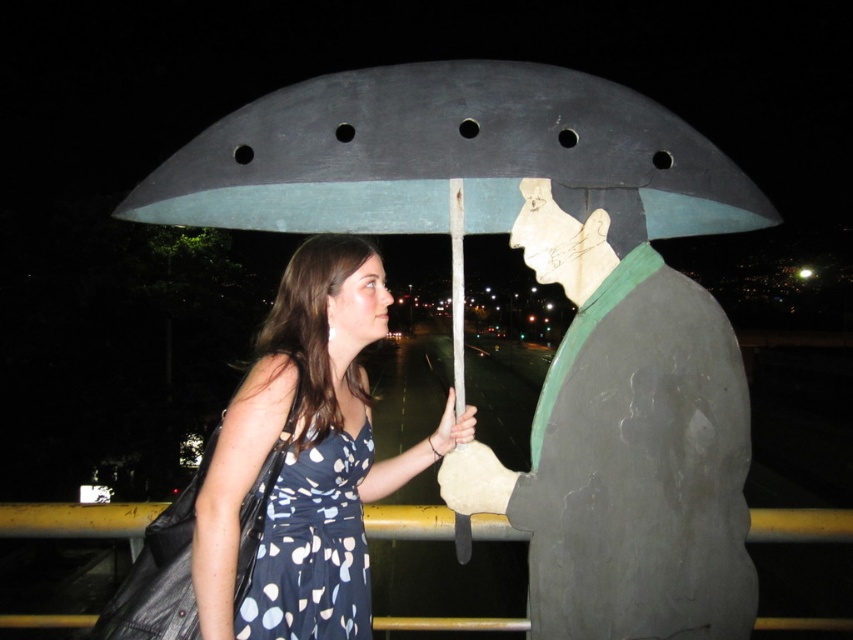
You are standing at the point marked as point (624,448). The statue is located at this point. Which direction should you face to see the woman in the sleeveless dress with dark blue base and white polka dots who is holding the umbrella handle with her right?

Since the woman is positioned to the left of the matte gray statue at center, you should face to the left direction to see her.

You are standing at point (445,160) in the image. What object are you touching?

The point at (445,160) is on the metallic gray umbrella at center.